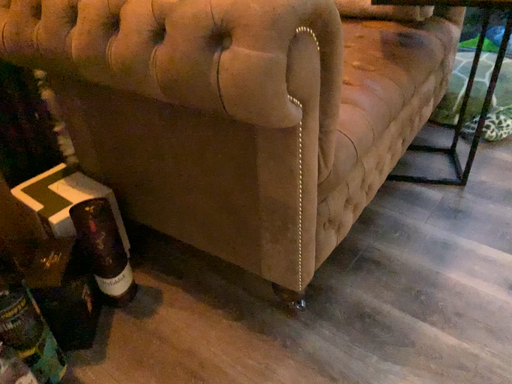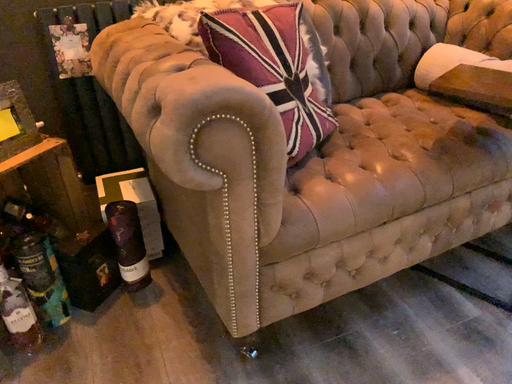
Question: Which way did the camera rotate in the video?

Choices:
 (A) rotated right
 (B) rotated left

Answer: (B)